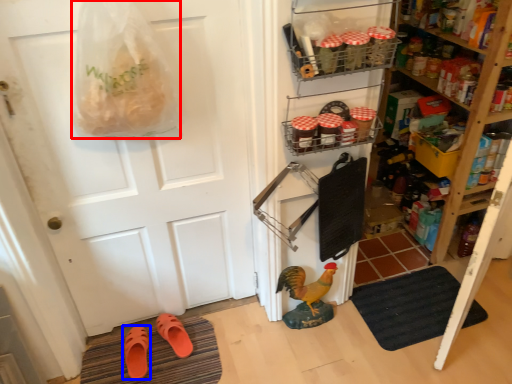
Question: Which object appears closest to the camera in this image, grocery bag (highlighted by a red box) or footwear (highlighted by a blue box)?

Choices:
 (A) grocery bag
 (B) footwear

Answer: (A)